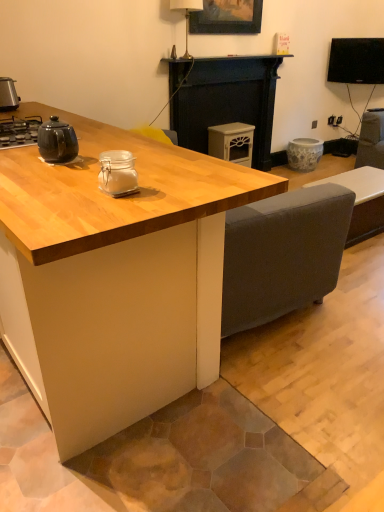
Where is `vacant space underneath matte black teapot at left (from a real-world perspective)`? The image size is (384, 512). vacant space underneath matte black teapot at left (from a real-world perspective) is located at coordinates (75, 160).